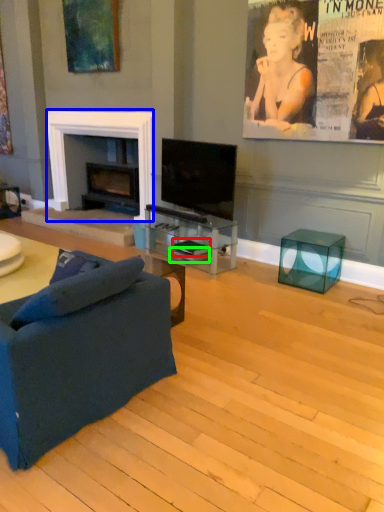
Question: Based on their relative distances, which object is farther from magazine (highlighted by a red box)? Choose from fireplace (highlighted by a blue box) and magazine (highlighted by a green box).

Choices:
 (A) fireplace
 (B) magazine

Answer: (A)